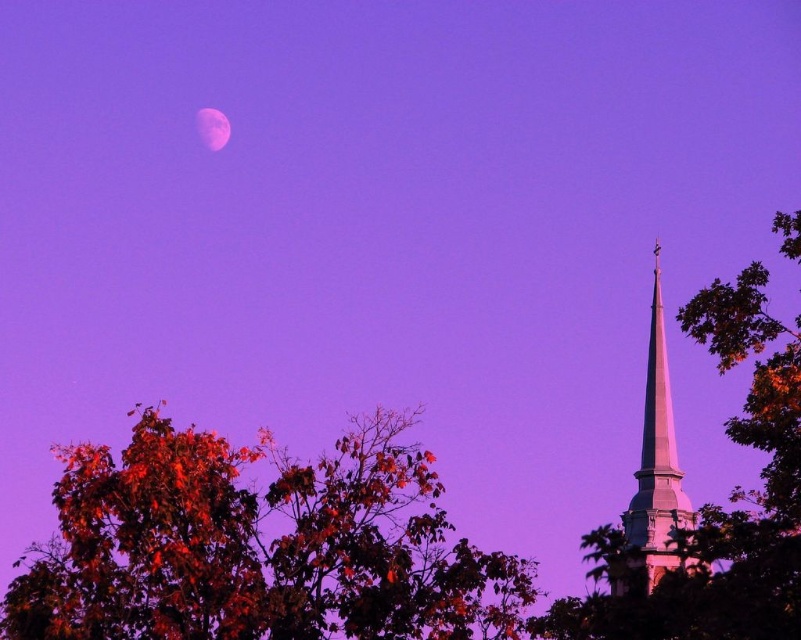
Looking at this image, you are a drone operator trying to fly a drone between the white smooth steeple at upper right and the pink translucent moon at upper center. The drone has a maximum flight distance of 200 feet. Can the drone safely navigate the space between them?

The white smooth steeple at upper right and pink translucent moon at upper center are 200.46 feet apart. Since the drone can only fly up to 200 feet, it cannot safely navigate the space between them as the distance exceeds its maximum range.

You are an astronomer observing the twilight sky. You notice the white smooth steeple at upper right and the pink translucent moon at upper center. Which object appears closer to your viewpoint?

The white smooth steeple at upper right is in front of the pink translucent moon at upper center, so it appears closer to your viewpoint.